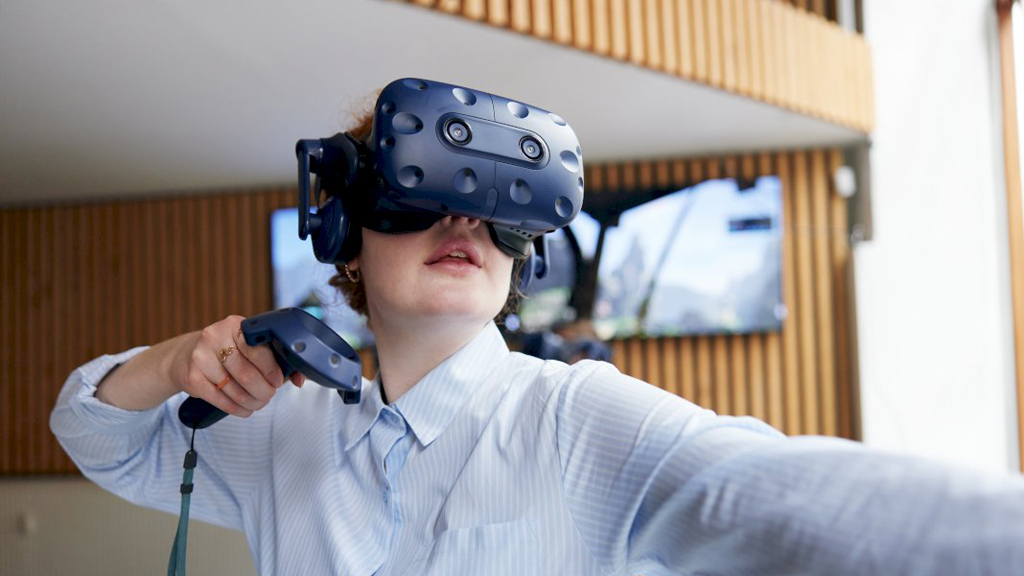
The image size is (1024, 576). What are the coordinates of `ceiling` in the screenshot? It's located at (203, 75).